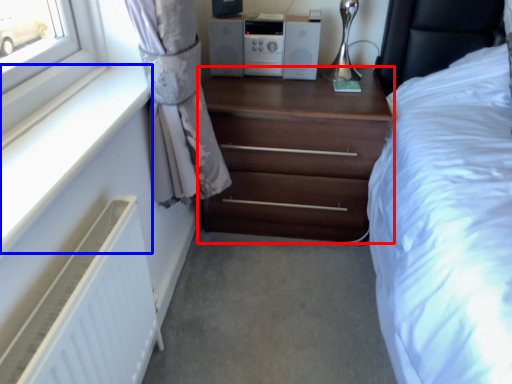
Question: Among these objects, which one is farthest to the camera, chest of drawers (highlighted by a red box) or window sill (highlighted by a blue box)?

Choices:
 (A) chest of drawers
 (B) window sill

Answer: (A)